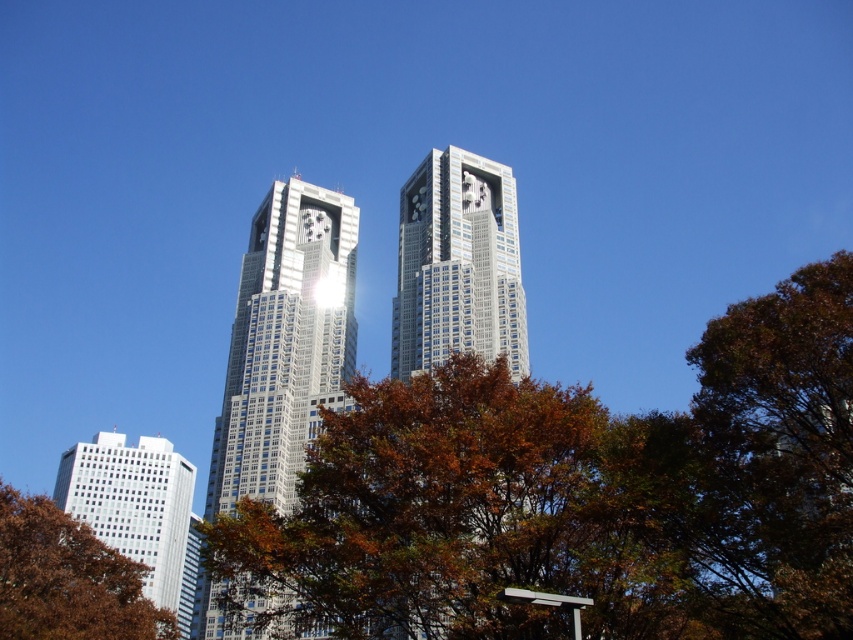
Is brown leafy tree at center to the left of brown leafy tree at lower left from the viewer's perspective?

Incorrect, brown leafy tree at center is not on the left side of brown leafy tree at lower left.

The width and height of the screenshot is (853, 640). I want to click on brown leafy tree at center, so click(579, 497).

Between silver glass skyscraper at center and brown leafy tree at lower left, which one appears on the right side from the viewer's perspective?

Positioned to the right is silver glass skyscraper at center.

Between point (428, 340) and point (163, 636), which one is positioned in front?

Point (163, 636)

Who is more forward, (405, 305) or (20, 582)?

Point (20, 582) is more forward.

You are a GUI agent. You are given a task and a screenshot of the screen. Output one action in this format:
    pyautogui.click(x=<x>, y=<y>)
    Task: Click on the silver glass skyscraper at center
    
    Given the screenshot: What is the action you would take?
    pyautogui.click(x=457, y=264)

Is reflective glass skyscraper at center shorter than brown leafy tree at lower left?

In fact, reflective glass skyscraper at center may be taller than brown leafy tree at lower left.

Is reflective glass skyscraper at center below brown leafy tree at lower left?

Actually, reflective glass skyscraper at center is above brown leafy tree at lower left.

You are a GUI agent. You are given a task and a screenshot of the screen. Output one action in this format:
    pyautogui.click(x=<x>, y=<y>)
    Task: Click on the reflective glass skyscraper at center
    The height and width of the screenshot is (640, 853).
    Given the screenshot: What is the action you would take?
    pyautogui.click(x=285, y=342)